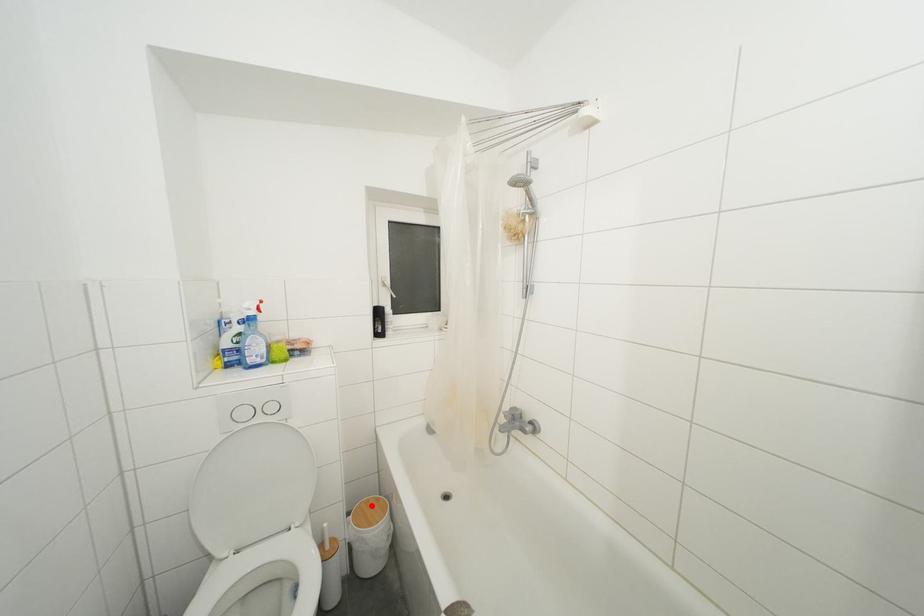
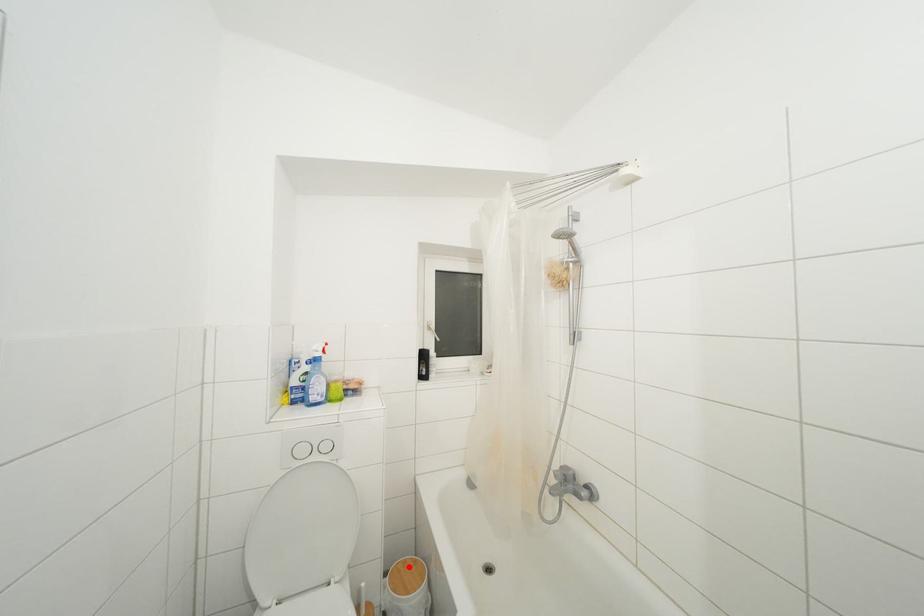
I am providing you with two images of the same scene from different viewpoints. A red point is marked on the first image and another point is marked on the second image. Do the highlighted points in image1 and image2 indicate the same real-world spot?

Yes